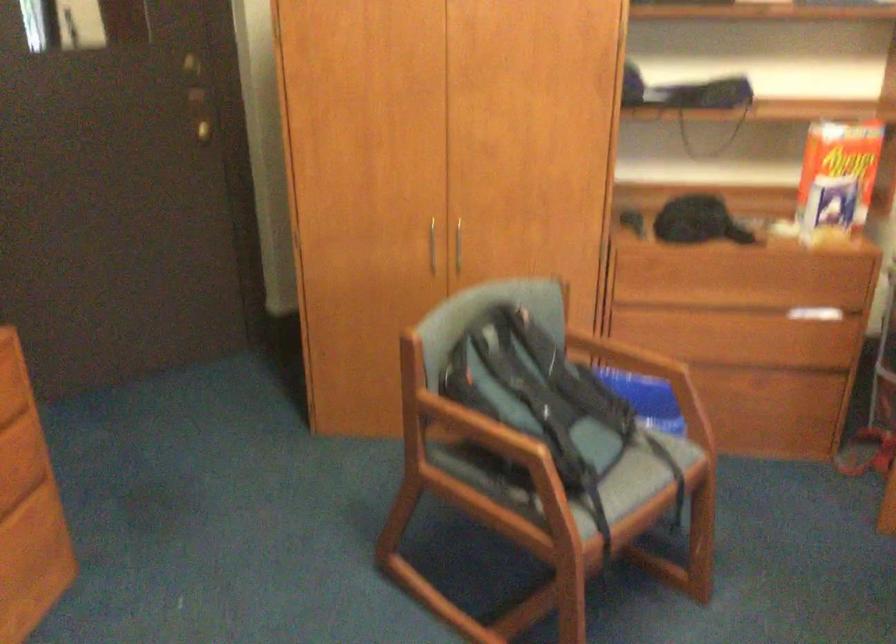
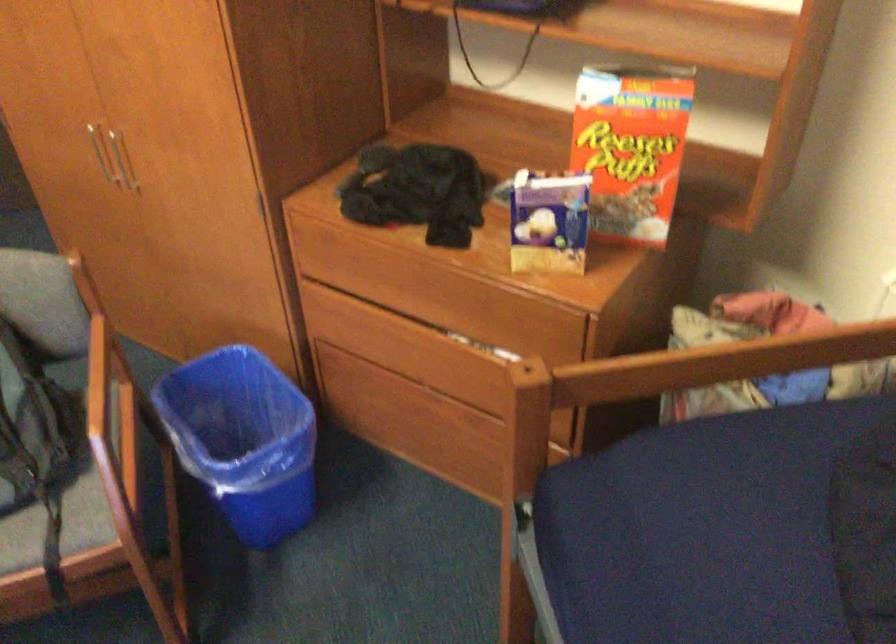
Which direction would the cameraman need to move to produce the second image?

The cameraman walked toward right, forward.